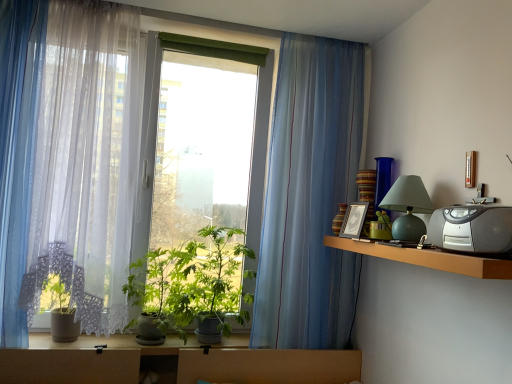
Question: Does matte green glass table lamp at right have a smaller size compared to translucent fabric curtain at left, which is the 3th curtain from right to left?

Choices:
 (A) yes
 (B) no

Answer: (A)

Question: From the image's perspective, is matte green glass table lamp at right located beneath translucent fabric curtain at left, which is the 1th curtain from left to right?

Choices:
 (A) no
 (B) yes

Answer: (B)

Question: Is matte green glass table lamp at right thinner than translucent fabric curtain at left, which is the 1th curtain from left to right?

Choices:
 (A) no
 (B) yes

Answer: (A)

Question: Is matte green glass table lamp at right aimed at translucent fabric curtain at left, which is the 3th curtain from right to left?

Choices:
 (A) no
 (B) yes

Answer: (B)

Question: Does matte green glass table lamp at right appear on the right side of translucent fabric curtain at left, which is the 1th curtain from left to right?

Choices:
 (A) no
 (B) yes

Answer: (B)

Question: Considering the positions of silver plastic radio at upper right and translucent blue curtain at center, acting as the first curtain starting from the right, in the image, is silver plastic radio at upper right bigger or smaller than translucent blue curtain at center, acting as the first curtain starting from the right,?

Choices:
 (A) big
 (B) small

Answer: (B)

Question: Is silver plastic radio at upper right inside the boundaries of translucent blue curtain at center, arranged as the 3th curtain when viewed from the left, or outside?

Choices:
 (A) inside
 (B) outside

Answer: (B)

Question: Considering the positions of silver plastic radio at upper right and translucent blue curtain at center, acting as the first curtain starting from the right, in the image, is silver plastic radio at upper right taller or shorter than translucent blue curtain at center, acting as the first curtain starting from the right,?

Choices:
 (A) tall
 (B) short

Answer: (B)

Question: In the image, is silver plastic radio at upper right on the left side or the right side of translucent blue curtain at center, arranged as the 3th curtain when viewed from the left?

Choices:
 (A) right
 (B) left

Answer: (A)

Question: Is silver plastic radio at upper right inside the boundaries of translucent fabric curtain at left, which is the 1th curtain from left to right, or outside?

Choices:
 (A) inside
 (B) outside

Answer: (B)

Question: Considering the positions of point (501, 220) and point (23, 269), is point (501, 220) closer or farther from the camera than point (23, 269)?

Choices:
 (A) farther
 (B) closer

Answer: (B)

Question: Considering the positions of silver plastic radio at upper right and translucent fabric curtain at left, which is the 1th curtain from left to right, in the image, is silver plastic radio at upper right taller or shorter than translucent fabric curtain at left, which is the 1th curtain from left to right,?

Choices:
 (A) short
 (B) tall

Answer: (A)

Question: From the image's perspective, is silver plastic radio at upper right above or below translucent fabric curtain at left, which is the 1th curtain from left to right?

Choices:
 (A) above
 (B) below

Answer: (B)

Question: Visually, is translucent fabric curtain at left, which is the 1th curtain from left to right, positioned to the left or to the right of translucent blue curtain at center, arranged as the 3th curtain when viewed from the left?

Choices:
 (A) left
 (B) right

Answer: (A)

Question: In the image, is translucent fabric curtain at left, which is the 3th curtain from right to left, positioned in front of or behind translucent blue curtain at center, acting as the first curtain starting from the right?

Choices:
 (A) behind
 (B) front

Answer: (B)